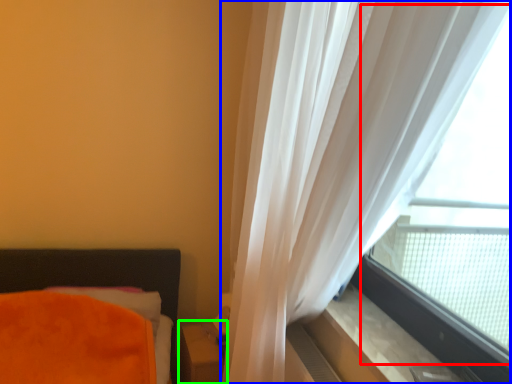
Question: Based on their relative distances, which object is farther from bay window (highlighted by a red box)? Choose from curtain (highlighted by a blue box) and table (highlighted by a green box).

Choices:
 (A) curtain
 (B) table

Answer: (B)